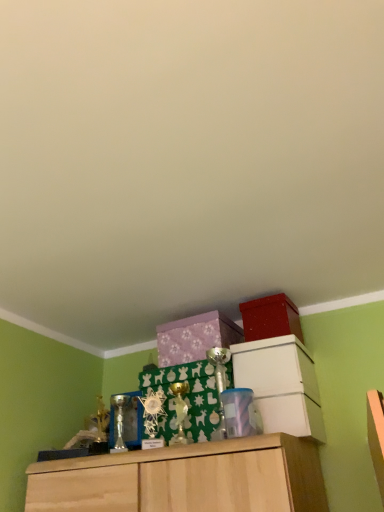
Question: Which direction should I rotate to look at purple matte box at center, positioned as the second cabinetry in right-to-left order, — up or down?

Choices:
 (A) down
 (B) up

Answer: (A)

Question: Can you confirm if matte red storage box at upper right is shorter than translucent plastic container at center?

Choices:
 (A) no
 (B) yes

Answer: (A)

Question: Does matte red storage box at upper right lie in front of translucent plastic container at center?

Choices:
 (A) no
 (B) yes

Answer: (A)

Question: Is matte red storage box at upper right further to the viewer compared to translucent plastic container at center?

Choices:
 (A) yes
 (B) no

Answer: (A)

Question: Is matte red storage box at upper right wider than translucent plastic container at center?

Choices:
 (A) no
 (B) yes

Answer: (A)

Question: Is matte red storage box at upper right thinner than translucent plastic container at center?

Choices:
 (A) no
 (B) yes

Answer: (B)

Question: Can translucent plastic container at center be found inside matte red storage box at upper right?

Choices:
 (A) no
 (B) yes

Answer: (A)

Question: From the image's perspective, is matte red storage box at upper right above purple matte box at center, positioned as the second cabinetry in right-to-left order?

Choices:
 (A) no
 (B) yes

Answer: (B)

Question: Is matte red storage box at upper right looking in the opposite direction of purple matte box at center, the 1th cabinetry in the left-to-right sequence?

Choices:
 (A) no
 (B) yes

Answer: (A)

Question: Is matte red storage box at upper right not near purple matte box at center, the 1th cabinetry in the left-to-right sequence?

Choices:
 (A) no
 (B) yes

Answer: (A)

Question: Can you confirm if matte red storage box at upper right is shorter than purple matte box at center, positioned as the second cabinetry in right-to-left order?

Choices:
 (A) no
 (B) yes

Answer: (A)

Question: Is matte red storage box at upper right located outside purple matte box at center, positioned as the second cabinetry in right-to-left order?

Choices:
 (A) no
 (B) yes

Answer: (B)

Question: Considering the relative sizes of matte red storage box at upper right and purple matte box at center, positioned as the second cabinetry in right-to-left order, in the image provided, is matte red storage box at upper right thinner than purple matte box at center, positioned as the second cabinetry in right-to-left order,?

Choices:
 (A) yes
 (B) no

Answer: (A)

Question: Is white matte cabinet at upper center, the first cabinetry in the right-to-left sequence, taller than translucent plastic container at center?

Choices:
 (A) yes
 (B) no

Answer: (A)